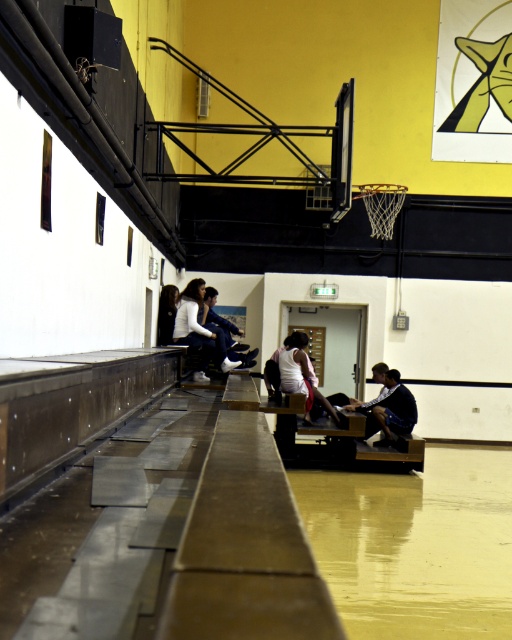
At what (x,y) coordinates should I click in order to perform the action: click on dark blue uniform at center. Please return your answer as a coordinate pair (x, y). Looking at the image, I should click on (327, 321).

Where is `dark blue uniform at center`? Image resolution: width=512 pixels, height=640 pixels. dark blue uniform at center is located at coordinates (327, 321).

Does dark blue jersey at center have a greater height compared to dark blue jeans at center?

Yes, dark blue jersey at center is taller than dark blue jeans at center.

Which of these two, dark blue jersey at center or dark blue jeans at center, stands shorter?

dark blue jeans at center is shorter.

Who is more forward, (349, 406) or (215, 323)?

Point (215, 323) is in front.

I want to click on dark blue jersey at center, so click(388, 406).

Is point (204, 365) less distant than point (307, 365)?

Yes, point (204, 365) is closer to viewer.

This screenshot has height=640, width=512. Describe the element at coordinates (200, 330) in the screenshot. I see `white fabric jacket at center` at that location.

Locate an element on the screen. white fabric jacket at center is located at coordinates (200, 330).